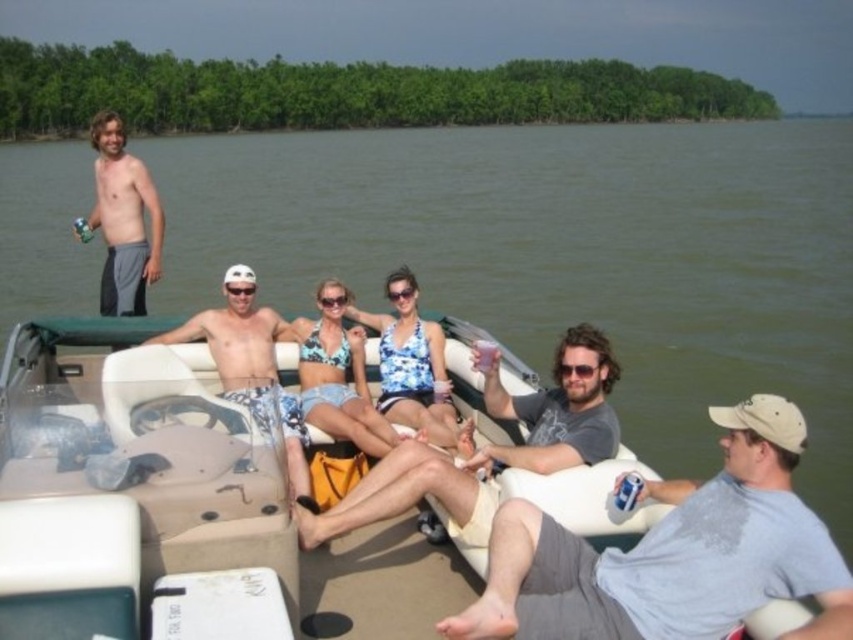
Question: Which object appears closest to the camera in this image?

Choices:
 (A) blue floral swimsuit at center
 (B) camouflage shorts at center

Answer: (A)

Question: Does gray cotton t-shirt at lower right appear on the left side of shiny gray shorts at left?

Choices:
 (A) no
 (B) yes

Answer: (A)

Question: Which of the following is the closest to the observer?

Choices:
 (A) gray cotton t-shirt at center
 (B) shiny gray shorts at left
 (C) gray cotton t-shirt at lower right

Answer: (C)

Question: Does green water at upper center lie behind shiny gray shorts at left?

Choices:
 (A) yes
 (B) no

Answer: (B)

Question: Can you confirm if green water at upper center is positioned above gray cotton t-shirt at lower right?

Choices:
 (A) yes
 (B) no

Answer: (A)

Question: Which object is closer to the camera taking this photo?

Choices:
 (A) gray cotton t-shirt at lower right
 (B) blue floral swimsuit at center

Answer: (A)